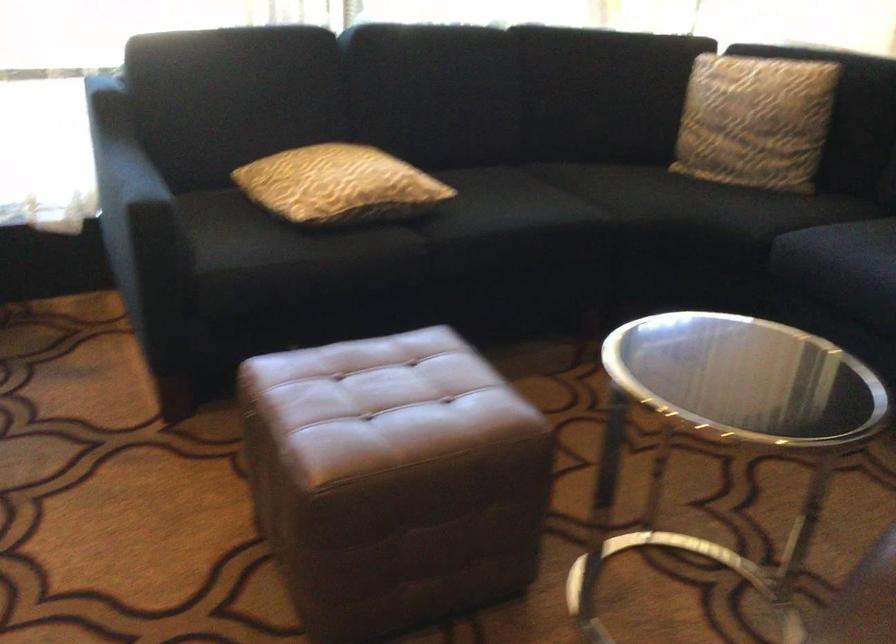
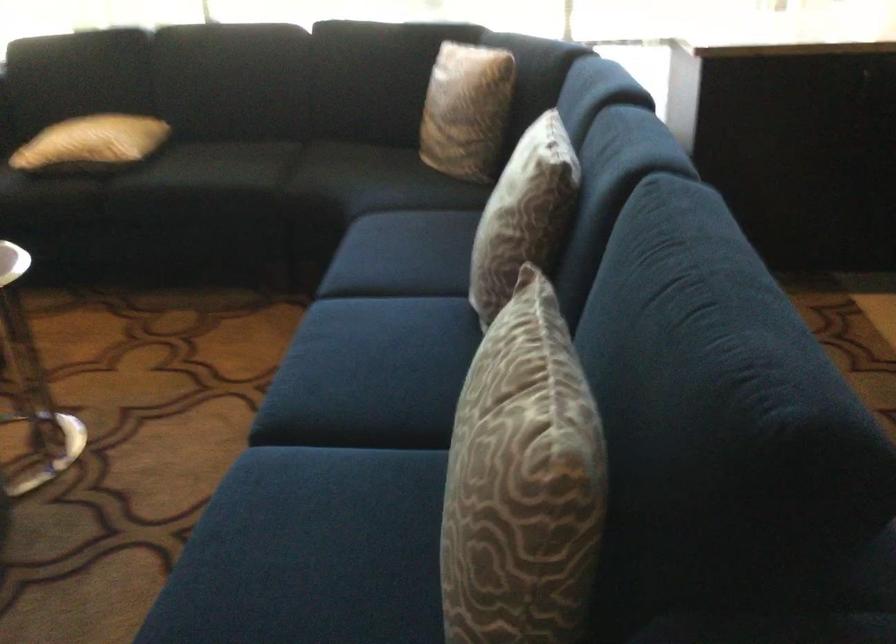
Where in the second image is the point corresponding to point 789,114 from the first image?

(467, 109)